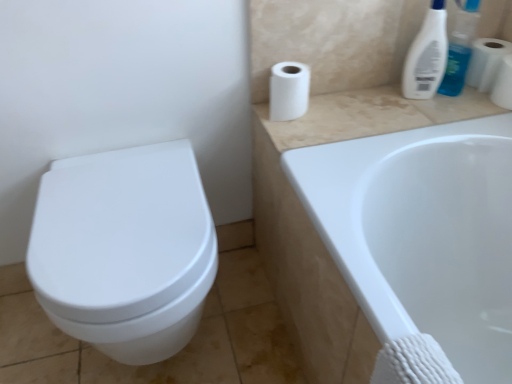
You are a GUI agent. You are given a task and a screenshot of the screen. Output one action in this format:
    pyautogui.click(x=<x>, y=<y>)
    Task: Click on the vacant area situated below beige marble counter top at upper right (from a real-world perspective)
    This screenshot has width=512, height=384.
    Given the screenshot: What is the action you would take?
    tap(379, 113)